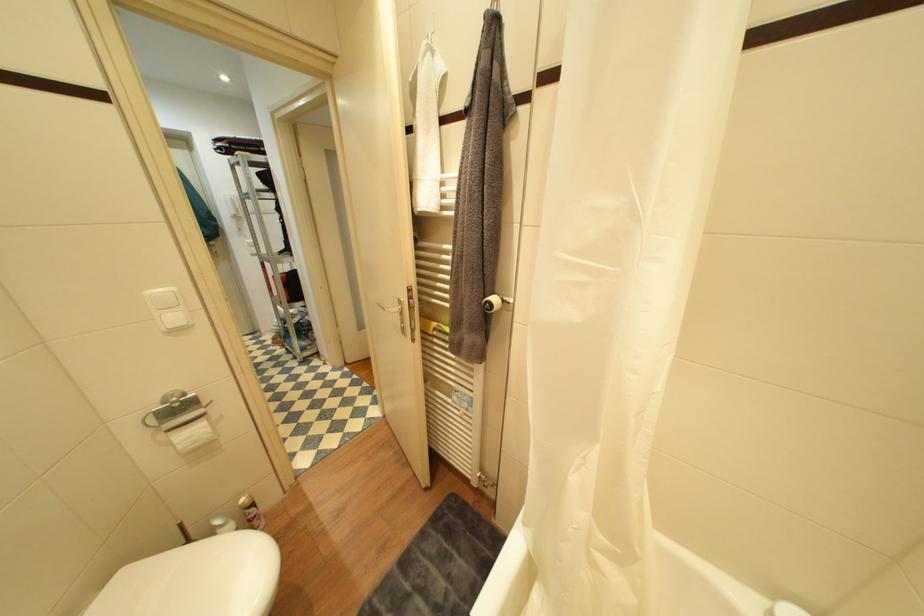
This screenshot has height=616, width=924. What are the coordinates of `aerosol spray can` in the screenshot? It's located at click(x=250, y=512).